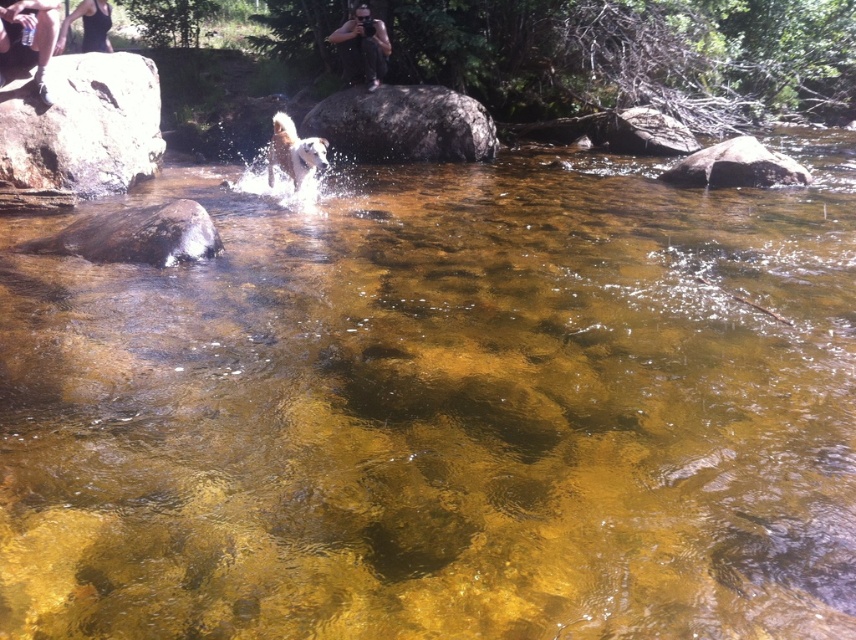
Measure the distance between point (419, 145) and camera.

Point (419, 145) and camera are 12.43 meters apart.

Can you confirm if gray textured rock at center is bigger than matte black shoe at upper left?

Correct, gray textured rock at center is larger in size than matte black shoe at upper left.

This screenshot has height=640, width=856. What do you see at coordinates (403, 124) in the screenshot?
I see `gray textured rock at center` at bounding box center [403, 124].

Find the location of `gray textured rock at center`. gray textured rock at center is located at coordinates click(403, 124).

Which is in front, point (0, 45) or point (290, 173)?

Point (0, 45)

Who is more distant from viewer, [45,40] or [277,148]?

The point [277,148] is more distant.

Image resolution: width=856 pixels, height=640 pixels. What do you see at coordinates (25, 38) in the screenshot? I see `matte black shoe at upper left` at bounding box center [25, 38].

This screenshot has width=856, height=640. I want to click on matte black shoe at upper left, so click(25, 38).

Does smooth gray rock at upper left come in front of white fur dog at center?

Yes, smooth gray rock at upper left is closer to the viewer.

Who is shorter, smooth gray rock at upper left or white fur dog at center?

white fur dog at center

You are a GUI agent. You are given a task and a screenshot of the screen. Output one action in this format:
    pyautogui.click(x=<x>, y=<y>)
    Task: Click on the smooth gray rock at upper left
    This screenshot has width=856, height=640.
    Given the screenshot: What is the action you would take?
    pyautogui.click(x=82, y=125)